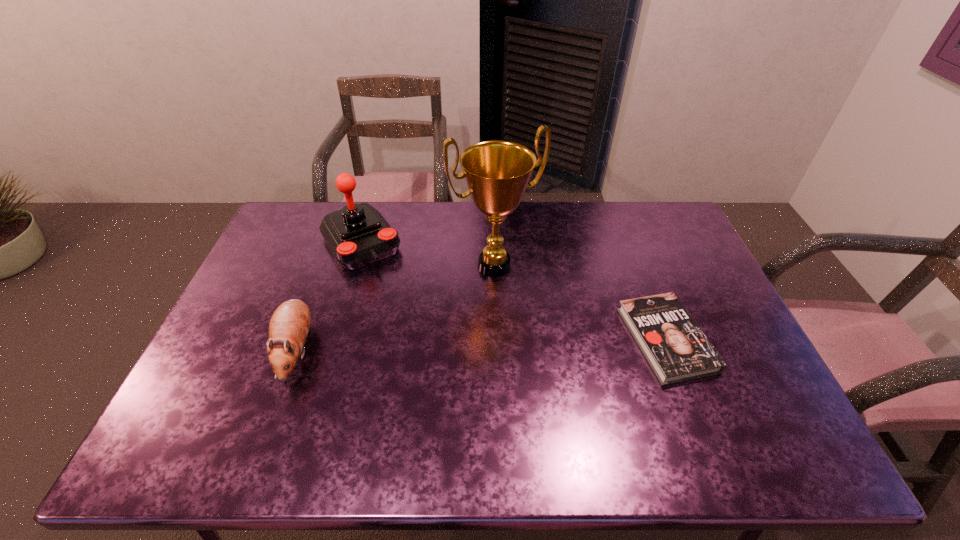
At what (x,y) coordinates should I click in order to perform the action: click on free space that is in between the third tallest object and the shortest object. Please return your answer as a coordinate pair (x, y). Looking at the image, I should click on (481, 345).

Locate an element on the screen. Image resolution: width=960 pixels, height=540 pixels. free space that is in between the shortest object and the joystick is located at coordinates (514, 291).

You are a GUI agent. You are given a task and a screenshot of the screen. Output one action in this format:
    pyautogui.click(x=<x>, y=<y>)
    Task: Click on the empty space that is in between the award and the second shortest object
    
    Given the screenshot: What is the action you would take?
    pyautogui.click(x=396, y=308)

You are a GUI agent. You are given a task and a screenshot of the screen. Output one action in this format:
    pyautogui.click(x=<x>, y=<y>)
    Task: Click on the free space between the second object from right to left and the hamster
    This screenshot has width=960, height=540.
    Given the screenshot: What is the action you would take?
    pyautogui.click(x=396, y=308)

What are the coordinates of `unoccupied position between the second shortest object and the book` in the screenshot? It's located at (481, 345).

Identify which object is the second nearest to the third object from left to right. Please provide its 2D coordinates. Your answer should be formatted as a tuple, i.e. [(x, y)], where the tuple contains the x and y coordinates of a point satisfying the conditions above.

[(677, 350)]

Locate which object ranks third in proximity to the book. Please provide its 2D coordinates. Your answer should be formatted as a tuple, i.e. [(x, y)], where the tuple contains the x and y coordinates of a point satisfying the conditions above.

[(289, 325)]